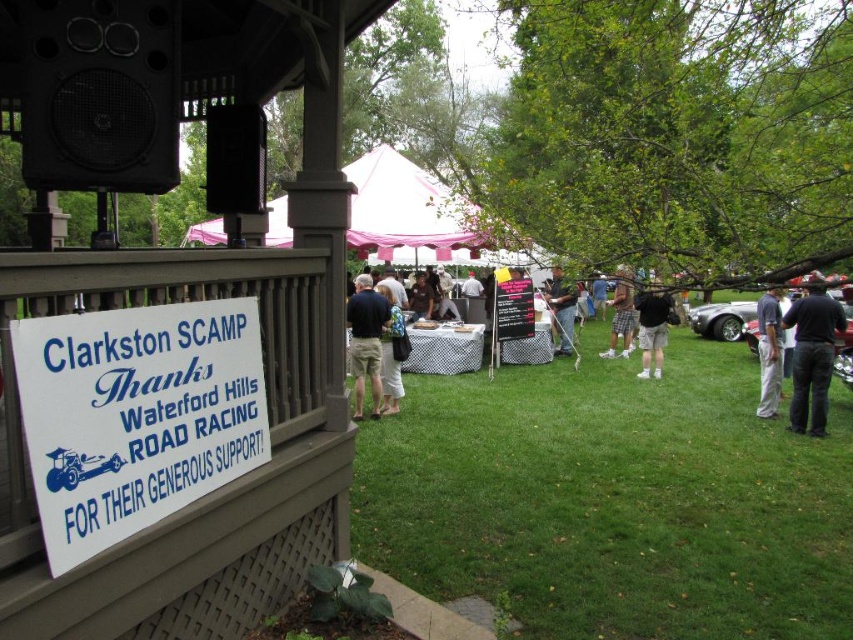
You are a photographer standing at the edge of the grassy area. You want to capture both the dark blue jeans at center and the camouflage shorts at center in a single photo. What is the minimum distance you need to step back to ensure both subjects are fully visible in your shot?

The minimum distance you need to step back is 6.86 feet to ensure both the dark blue jeans at center and the camouflage shorts at center are fully visible in your photo.

You are organizing a photo shoot and need to frame both the white wood sign at lower left and the dark blue shirt at center in the same shot. Which object should you position closer to the camera to ensure both fit within the frame?

You should position the dark blue shirt at center closer to the camera because the white wood sign at lower left is wider than the dark blue shirt at center, making it necessary to adjust their distances to balance their sizes in the frame.